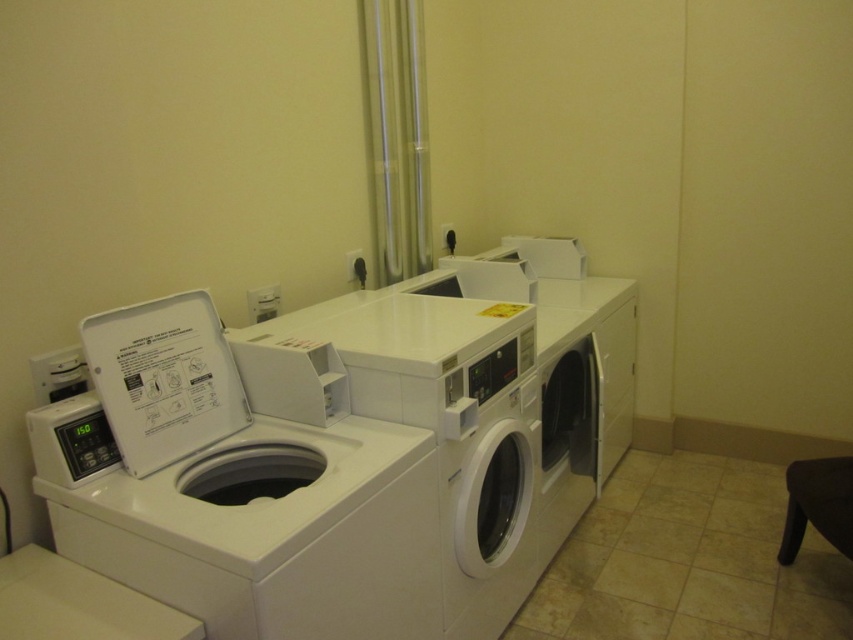
Question: Does white matte washer at center come in front of black leather stool at lower right?

Choices:
 (A) yes
 (B) no

Answer: (A)

Question: Does white plastic washer at left appear over black leather stool at lower right?

Choices:
 (A) yes
 (B) no

Answer: (A)

Question: Which of the following is the closest to the observer?

Choices:
 (A) white plastic washer at left
 (B) white matte washer at center

Answer: (A)

Question: Among these points, which one is farthest from the camera?

Choices:
 (A) (236, 545)
 (B) (798, 492)

Answer: (B)

Question: Does white plastic washer at left come behind black leather stool at lower right?

Choices:
 (A) yes
 (B) no

Answer: (B)

Question: Which object is the farthest from the black leather stool at lower right?

Choices:
 (A) white plastic washer at left
 (B) white matte washer at center

Answer: (A)